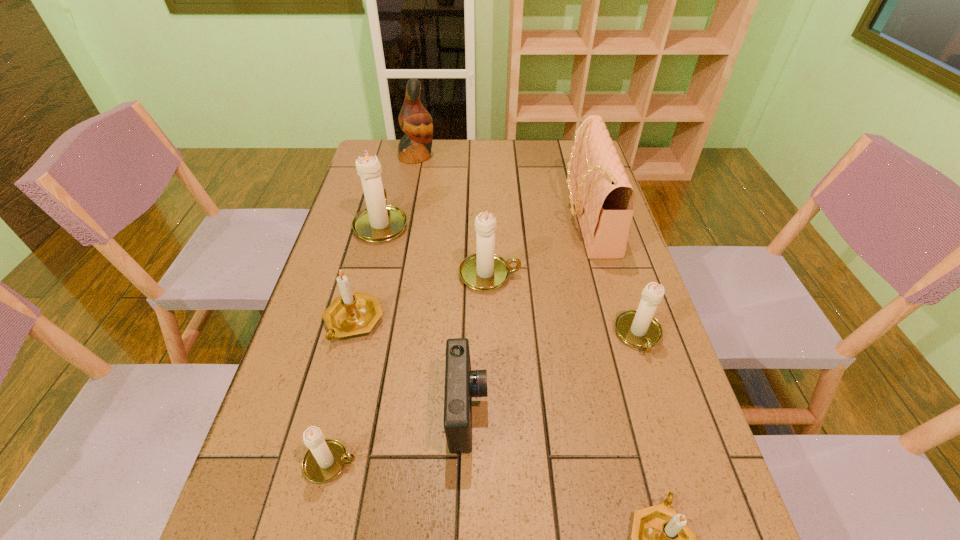
Image resolution: width=960 pixels, height=540 pixels. What are the coordinates of `parrot` in the screenshot? It's located at (415, 121).

Where is `red parrot`? Image resolution: width=960 pixels, height=540 pixels. red parrot is located at coordinates (415, 121).

Where is `the tallest candle holder`? the tallest candle holder is located at coordinates (379, 222).

Identify the location of the biggest white candle holder. This screenshot has width=960, height=540. (379, 222).

Where is `handbag`? handbag is located at coordinates (604, 199).

This screenshot has height=540, width=960. I want to click on the sixth shortest object, so click(483, 271).

Locate an element on the screen. The height and width of the screenshot is (540, 960). the second farthest white candle holder is located at coordinates (483, 271).

What are the coordinates of `the farther gold candle holder` in the screenshot? It's located at (355, 313).

You are a GUI agent. You are given a task and a screenshot of the screen. Output one action in this format:
    pyautogui.click(x=<x>, y=<y>)
    Task: Click on the left gold candle holder
    This screenshot has height=540, width=960.
    Given the screenshot: What is the action you would take?
    pyautogui.click(x=355, y=313)

At what (x,y) coordinates should I click in order to perform the action: click on the third farthest white candle holder. Please return your answer as a coordinate pair (x, y). This screenshot has height=540, width=960. Looking at the image, I should click on (638, 328).